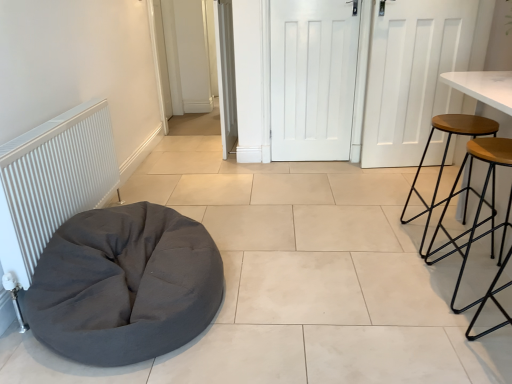
Image resolution: width=512 pixels, height=384 pixels. I want to click on vacant space in wooden seat stool at right, the first stool in the back-to-front sequence (from a real-world perspective), so click(438, 240).